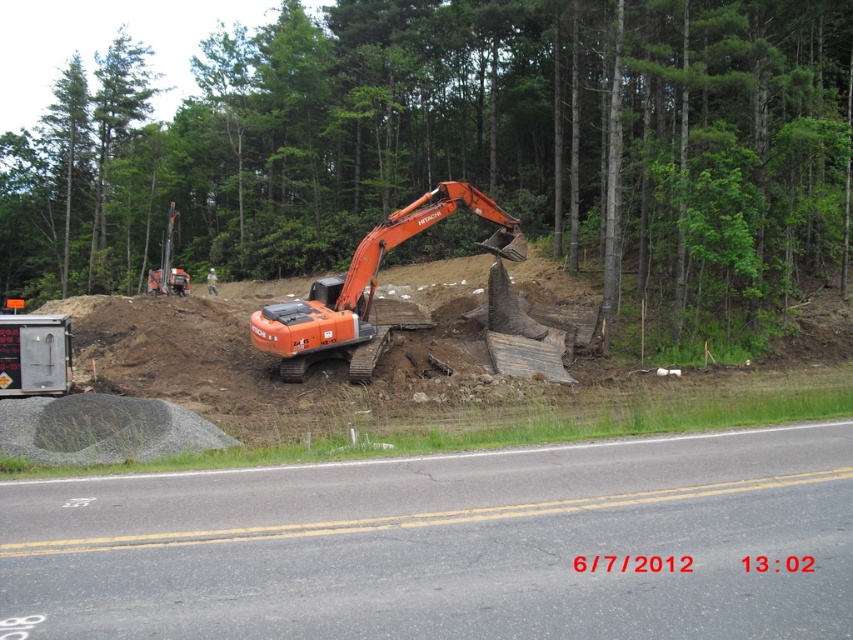
You are a delivery truck driver who needs to pass through the construction site shown in the image. The truck is 2.5 meters wide. The road has two lanes, each 3 meters wide, separated by yellow double lines. The orange rubber excavator at center is positioned at coordinates 0.450, 0.433. Can you safely navigate your truck around the excavator while staying within the road lanes?

The orange rubber excavator at center is located at coordinates (368, 288). Given that each lane is 3 meters wide and your truck is 2.5 meters wide, you should be able to safely navigate around the excavator by staying within your lane. However, you must ensure there is enough clearance and that the excavator is not obstructing both lanes. If the excavator is entirely within one lane, you can maneuver around it while staying in your lane. Always check for any oncoming traffic and follow the road markings.

You are a delivery driver who needs to maneuver your truck through this construction site. Your truck is 8 meters long. There is an orange rubber excavator at center and a brushed metal trailer truck at lower left. Can you safely pass between them without hitting either?

The orange rubber excavator at center is 7.58 meters away from the brushed metal trailer truck at lower left. Since your truck is 8 meters long, it is slightly longer than the available space between them. Therefore, you cannot safely pass between them without risking a collision.

You are a delivery driver approaching the construction site. You notice a point marked at coordinates (448, 545). What is located at this point?

The point at coordinates (448, 545) is where the black asphalt road at lower center is located.